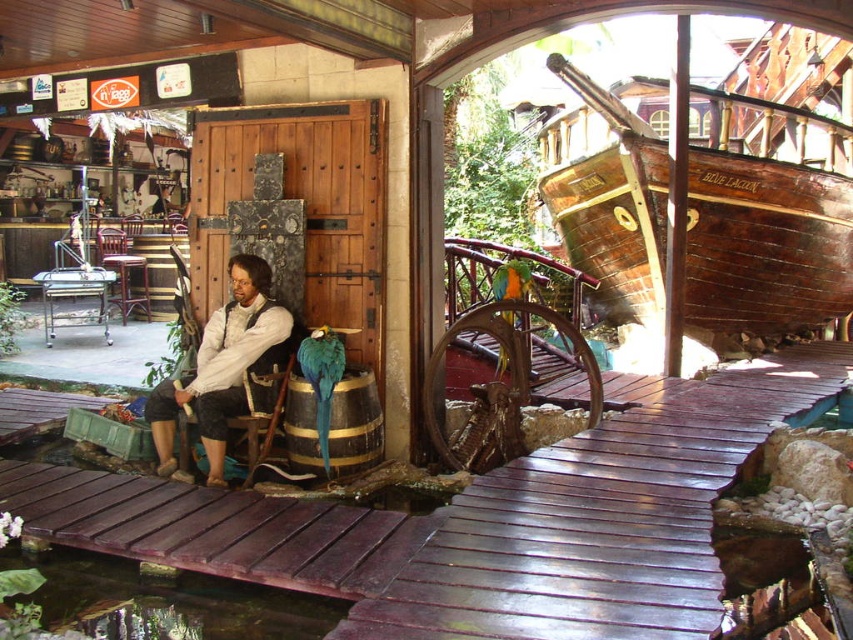
Is point (633, 129) positioned before point (112, 275)?

Yes, it is in front of point (112, 275).

Does wooden ship at right have a lesser height compared to metallic silver chair at left?

No, wooden ship at right is not shorter than metallic silver chair at left.

Is point (788, 268) positioned before point (106, 275)?

That is True.

You are a GUI agent. You are given a task and a screenshot of the screen. Output one action in this format:
    pyautogui.click(x=<x>, y=<y>)
    Task: Click on the wooden ship at right
    
    Given the screenshot: What is the action you would take?
    pyautogui.click(x=766, y=224)

Which is above, wooden ship at right or brown wooden dock at center?

wooden ship at right is above.

Which is more to the left, wooden ship at right or brown wooden dock at center?

brown wooden dock at center

This screenshot has height=640, width=853. What do you see at coordinates (766, 224) in the screenshot?
I see `wooden ship at right` at bounding box center [766, 224].

The width and height of the screenshot is (853, 640). Find the location of `wooden ship at right`. wooden ship at right is located at coordinates pyautogui.click(x=766, y=224).

How far apart are shiny brown wood dock at center and brown wooden dock at center?

shiny brown wood dock at center and brown wooden dock at center are 38.21 inches apart.

Can you confirm if shiny brown wood dock at center is shorter than brown wooden dock at center?

Incorrect, shiny brown wood dock at center's height does not fall short of brown wooden dock at center's.

Who is more forward, (683, 620) or (386, 513)?

Positioned in front is point (683, 620).

Locate an element on the screen. shiny brown wood dock at center is located at coordinates (601, 520).